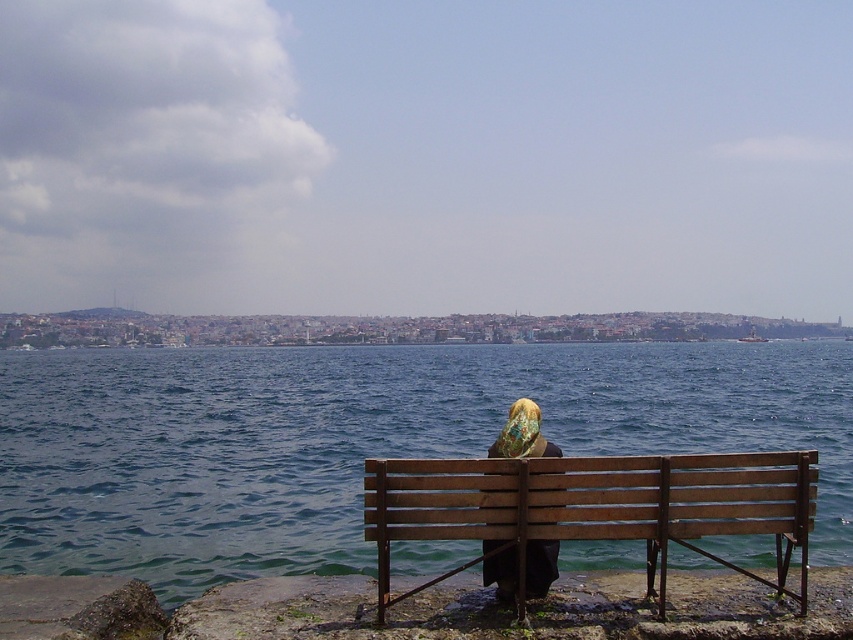
Question: Observing the image, what is the correct spatial positioning of blue water at center in reference to matte black headscarf at center?

Choices:
 (A) right
 (B) left

Answer: (A)

Question: Among these points, which one is farthest from the camera?

Choices:
 (A) (547, 564)
 (B) (567, 538)

Answer: (A)

Question: Among these objects, which one is nearest to the camera?

Choices:
 (A) blue water at center
 (B) matte black headscarf at center

Answer: (B)

Question: Is wooden bench at lower center above matte black headscarf at center?

Choices:
 (A) yes
 (B) no

Answer: (A)

Question: In this image, where is blue water at center located relative to wooden bench at lower center?

Choices:
 (A) above
 (B) below

Answer: (B)

Question: Which object appears farthest from the camera in this image?

Choices:
 (A) blue water at center
 (B) matte black headscarf at center
 (C) wooden bench at lower center

Answer: (A)